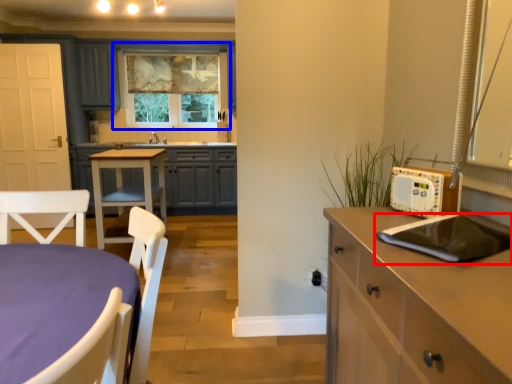
Question: Which object appears farthest to the camera in this image, kitchen appliance (highlighted by a red box) or window (highlighted by a blue box)?

Choices:
 (A) kitchen appliance
 (B) window

Answer: (B)